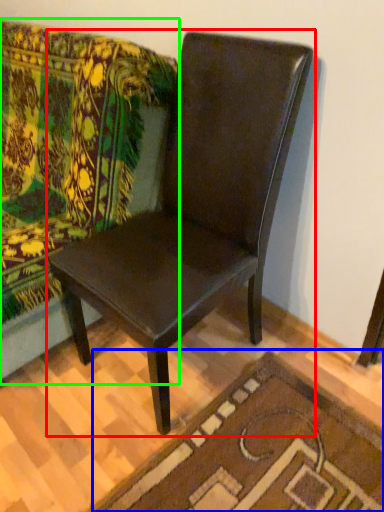
Question: Which is nearer to the chair (highlighted by a red box)? doormat (highlighted by a blue box) or studio couch (highlighted by a green box).

Choices:
 (A) doormat
 (B) studio couch

Answer: (B)